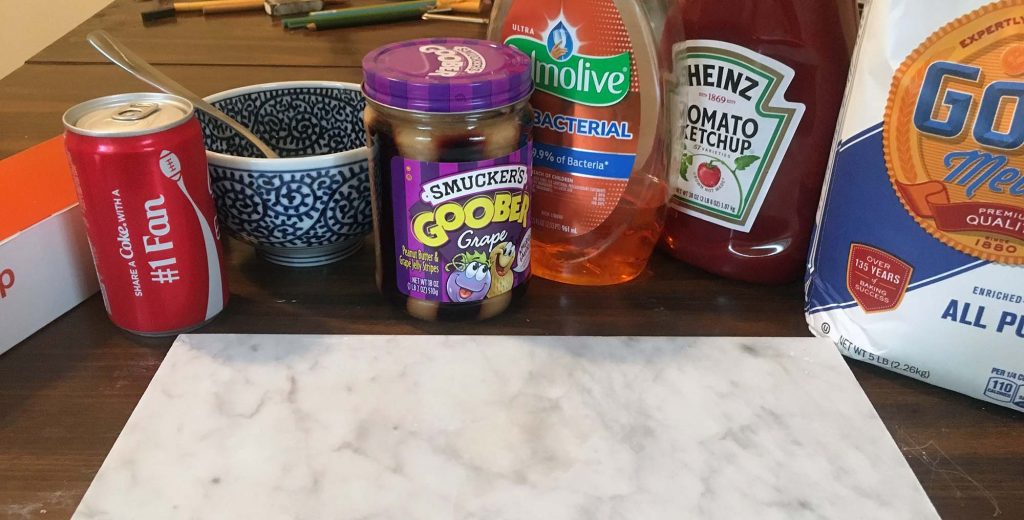
At what (x,y) coordinates should I click in order to perform the action: click on bowl. Please return your answer as a coordinate pair (x, y). The height and width of the screenshot is (520, 1024). Looking at the image, I should click on (280, 211).